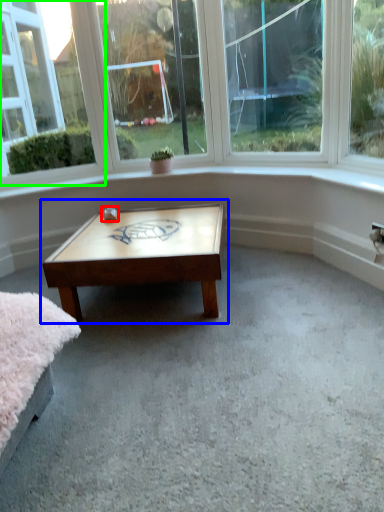
Question: Estimate the real-world distances between objects in this image. Which object is farther from table (highlighted by a red box), coffee table (highlighted by a blue box) or window (highlighted by a green box)?

Choices:
 (A) coffee table
 (B) window

Answer: (B)